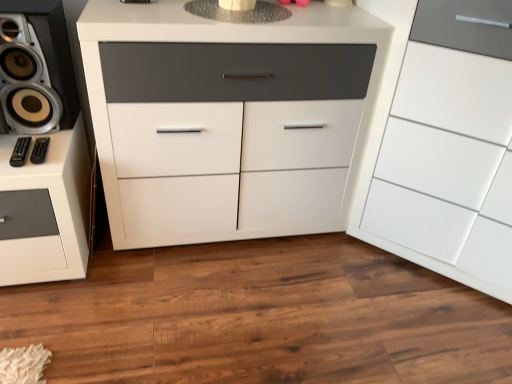
What do you see at coordinates (442, 146) in the screenshot? I see `white glossy cabinet at right, the second chest of drawers when ordered from left to right` at bounding box center [442, 146].

At what (x,y) coordinates should I click in order to perform the action: click on black plastic remote control at lower left, which is the first audio in right-to-left order. Please return your answer as a coordinate pair (x, y). Looking at the image, I should click on (39, 150).

Considering the relative sizes of black plastic remote control at lower left, which ranks as the 2th audio in left-to-right order, and metallic silver speaker at left in the image provided, is black plastic remote control at lower left, which ranks as the 2th audio in left-to-right order, smaller than metallic silver speaker at left?

Yes.

Which is behind, black plastic remote control at lower left, which ranks as the 2th audio in left-to-right order, or metallic silver speaker at left?

black plastic remote control at lower left, which ranks as the 2th audio in left-to-right order, is further away from the camera.

From the image's perspective, is black plastic remote control at lower left, which ranks as the 2th audio in left-to-right order, on top of metallic silver speaker at left?

No.

Are black plastic remote control at lower left, which ranks as the 2th audio in left-to-right order, and metallic silver speaker at left located far from each other?

No, there isn't a large distance between black plastic remote control at lower left, which ranks as the 2th audio in left-to-right order, and metallic silver speaker at left.

Is there a large distance between black plastic remote control at lower left, which is the first audio in right-to-left order, and white glossy cabinet at right, the second chest of drawers when ordered from left to right?

Yes, black plastic remote control at lower left, which is the first audio in right-to-left order, and white glossy cabinet at right, the second chest of drawers when ordered from left to right, are quite far apart.

Is black plastic remote control at lower left, which is the first audio in right-to-left order, aimed at white glossy cabinet at right, the second chest of drawers when ordered from left to right?

No.

From a real-world perspective, is black plastic remote control at lower left, which ranks as the 2th audio in left-to-right order, located beneath white glossy cabinet at right, positioned as the 1th chest of drawers in right-to-left order?

Yes, from a real-world perspective, black plastic remote control at lower left, which ranks as the 2th audio in left-to-right order, is below white glossy cabinet at right, positioned as the 1th chest of drawers in right-to-left order.

Is white matte cabinet at center, marked as the first chest of drawers in a left-to-right arrangement, thinner than metallic silver speaker at left?

No, white matte cabinet at center, marked as the first chest of drawers in a left-to-right arrangement, is not thinner than metallic silver speaker at left.

From the image's perspective, which one is positioned higher, white matte cabinet at center, marked as the first chest of drawers in a left-to-right arrangement, or metallic silver speaker at left?

metallic silver speaker at left appears higher in the image.

Looking at the image, does white matte cabinet at center, marked as the first chest of drawers in a left-to-right arrangement, seem bigger or smaller compared to metallic silver speaker at left?

Considering their sizes, white matte cabinet at center, marked as the first chest of drawers in a left-to-right arrangement, takes up more space than metallic silver speaker at left.

Image resolution: width=512 pixels, height=384 pixels. I want to click on audio above the black plastic remote control at lower left, which is the first audio in right-to-left order (from a real-world perspective), so click(x=20, y=152).

How many degrees apart are the facing directions of black plastic remote control at lower left, which is the first audio in right-to-left order, and black plastic remote control at lower left, which is the 1th audio in left-to-right order?

4.21 degrees.

Which of these two, black plastic remote control at lower left, which is the first audio in right-to-left order, or black plastic remote control at lower left, acting as the 2th audio starting from the right, stands taller?

black plastic remote control at lower left, acting as the 2th audio starting from the right.

Looking at this image, is the depth of black plastic remote control at lower left, which ranks as the 2th audio in left-to-right order, greater than that of black plastic remote control at lower left, acting as the 2th audio starting from the right?

Yes, black plastic remote control at lower left, which ranks as the 2th audio in left-to-right order, is further from the camera.

Considering the positions of objects black plastic remote control at lower left, which is the 1th audio in left-to-right order, and metallic silver speaker at left in the image provided, who is more to the right, black plastic remote control at lower left, which is the 1th audio in left-to-right order, or metallic silver speaker at left?

From the viewer's perspective, black plastic remote control at lower left, which is the 1th audio in left-to-right order, appears more on the right side.

From a real-world perspective, which object stands above the other?

In real-world perspective, metallic silver speaker at left is above.

From the image's perspective, which one is positioned lower, black plastic remote control at lower left, which is the 1th audio in left-to-right order, or metallic silver speaker at left?

black plastic remote control at lower left, which is the 1th audio in left-to-right order, is shown below in the image.

In terms of size, does black plastic remote control at lower left, acting as the 2th audio starting from the right, appear bigger or smaller than metallic silver speaker at left?

In the image, black plastic remote control at lower left, acting as the 2th audio starting from the right, appears to be smaller than metallic silver speaker at left.

Which object is further away from the camera, black plastic remote control at lower left, acting as the 2th audio starting from the right, or white glossy cabinet at right, positioned as the 1th chest of drawers in right-to-left order?

Positioned behind is black plastic remote control at lower left, acting as the 2th audio starting from the right.

Visually, is black plastic remote control at lower left, acting as the 2th audio starting from the right, positioned to the left or to the right of white glossy cabinet at right, the second chest of drawers when ordered from left to right?

black plastic remote control at lower left, acting as the 2th audio starting from the right, is positioned on white glossy cabinet at right, the second chest of drawers when ordered from left to right,'s left side.

Is point (29, 142) closer to camera compared to point (493, 221)?

Yes, point (29, 142) is closer to viewer.

From the picture: Are black plastic remote control at lower left, acting as the 2th audio starting from the right, and white glossy cabinet at right, the second chest of drawers when ordered from left to right, located far from each other?

Absolutely, black plastic remote control at lower left, acting as the 2th audio starting from the right, is distant from white glossy cabinet at right, the second chest of drawers when ordered from left to right.

From a real-world perspective, relative to black plastic remote control at lower left, which ranks as the 2th audio in left-to-right order, is white matte cabinet at center, the 2th chest of drawers when ordered from right to left, vertically above or below?

white matte cabinet at center, the 2th chest of drawers when ordered from right to left, is situated lower than black plastic remote control at lower left, which ranks as the 2th audio in left-to-right order, in the real world.

Which is in front, point (160, 147) or point (41, 140)?

Positioned in front is point (41, 140).

Find the location of `the chest of drawers that is the 1st one when counting rightward from the black plastic remote control at lower left, which is the first audio in right-to-left order`. the chest of drawers that is the 1st one when counting rightward from the black plastic remote control at lower left, which is the first audio in right-to-left order is located at coordinates pyautogui.click(x=228, y=119).

Visually, is white matte cabinet at center, marked as the first chest of drawers in a left-to-right arrangement, positioned to the left or to the right of black plastic remote control at lower left, which is the first audio in right-to-left order?

Clearly, white matte cabinet at center, marked as the first chest of drawers in a left-to-right arrangement, is on the right of black plastic remote control at lower left, which is the first audio in right-to-left order, in the image.

Where is `the 1st audio below the metallic silver speaker at left (from the image's perspective)`? The image size is (512, 384). the 1st audio below the metallic silver speaker at left (from the image's perspective) is located at coordinates (39, 150).

The height and width of the screenshot is (384, 512). Find the location of `the 1st audio to the left of the white glossy cabinet at right, the second chest of drawers when ordered from left to right, starting your count from the anchor`. the 1st audio to the left of the white glossy cabinet at right, the second chest of drawers when ordered from left to right, starting your count from the anchor is located at coordinates (39, 150).

From the image, which object appears to be farther from white matte cabinet at center, marked as the first chest of drawers in a left-to-right arrangement, white glossy cabinet at right, positioned as the 1th chest of drawers in right-to-left order, or black plastic remote control at lower left, acting as the 2th audio starting from the right?

black plastic remote control at lower left, acting as the 2th audio starting from the right, is further to white matte cabinet at center, marked as the first chest of drawers in a left-to-right arrangement.

From the image, which object appears to be farther from metallic silver speaker at left, white matte cabinet at center, marked as the first chest of drawers in a left-to-right arrangement, or black plastic remote control at lower left, which is the 1th audio in left-to-right order?

Based on the image, white matte cabinet at center, marked as the first chest of drawers in a left-to-right arrangement, appears to be further to metallic silver speaker at left.

Estimate the real-world distances between objects in this image. Which object is further from white matte cabinet at center, the 2th chest of drawers when ordered from right to left, white glossy cabinet at right, positioned as the 1th chest of drawers in right-to-left order, or black plastic remote control at lower left, which is the first audio in right-to-left order?

black plastic remote control at lower left, which is the first audio in right-to-left order, is further to white matte cabinet at center, the 2th chest of drawers when ordered from right to left.

Estimate the real-world distances between objects in this image. Which object is further from white glossy cabinet at right, positioned as the 1th chest of drawers in right-to-left order, metallic silver speaker at left or black plastic remote control at lower left, which ranks as the 2th audio in left-to-right order?

Among the two, black plastic remote control at lower left, which ranks as the 2th audio in left-to-right order, is located further to white glossy cabinet at right, positioned as the 1th chest of drawers in right-to-left order.

Considering their positions, is metallic silver speaker at left positioned further to white glossy cabinet at right, positioned as the 1th chest of drawers in right-to-left order, than black plastic remote control at lower left, acting as the 2th audio starting from the right?

black plastic remote control at lower left, acting as the 2th audio starting from the right.

From the picture: Looking at the image, which one is located further to white glossy cabinet at right, the second chest of drawers when ordered from left to right, white matte cabinet at center, the 2th chest of drawers when ordered from right to left, or metallic silver speaker at left?

metallic silver speaker at left is positioned further to the anchor white glossy cabinet at right, the second chest of drawers when ordered from left to right.

Which object lies further to the anchor point white glossy cabinet at right, positioned as the 1th chest of drawers in right-to-left order, white matte cabinet at center, the 2th chest of drawers when ordered from right to left, or black plastic remote control at lower left, acting as the 2th audio starting from the right?

Based on the image, black plastic remote control at lower left, acting as the 2th audio starting from the right, appears to be further to white glossy cabinet at right, positioned as the 1th chest of drawers in right-to-left order.

Based on their spatial positions, is black plastic remote control at lower left, which is the first audio in right-to-left order, or metallic silver speaker at left closer to black plastic remote control at lower left, acting as the 2th audio starting from the right?

Based on the image, black plastic remote control at lower left, which is the first audio in right-to-left order, appears to be nearer to black plastic remote control at lower left, acting as the 2th audio starting from the right.

Find the location of `the chest of drawers situated between black plastic remote control at lower left, which is the first audio in right-to-left order, and white glossy cabinet at right, the second chest of drawers when ordered from left to right, from left to right`. the chest of drawers situated between black plastic remote control at lower left, which is the first audio in right-to-left order, and white glossy cabinet at right, the second chest of drawers when ordered from left to right, from left to right is located at coordinates 228,119.

In order to click on chest of drawers between black plastic remote control at lower left, acting as the 2th audio starting from the right, and white glossy cabinet at right, positioned as the 1th chest of drawers in right-to-left order in this screenshot , I will do `click(228, 119)`.

You are a GUI agent. You are given a task and a screenshot of the screen. Output one action in this format:
    pyautogui.click(x=<x>, y=<y>)
    Task: Click on the audio between black plastic remote control at lower left, acting as the 2th audio starting from the right, and white glossy cabinet at right, the second chest of drawers when ordered from left to right
    Image resolution: width=512 pixels, height=384 pixels.
    Given the screenshot: What is the action you would take?
    pyautogui.click(x=39, y=150)

The height and width of the screenshot is (384, 512). I want to click on chest of drawers between metallic silver speaker at left and white glossy cabinet at right, the second chest of drawers when ordered from left to right, from left to right, so click(x=228, y=119).